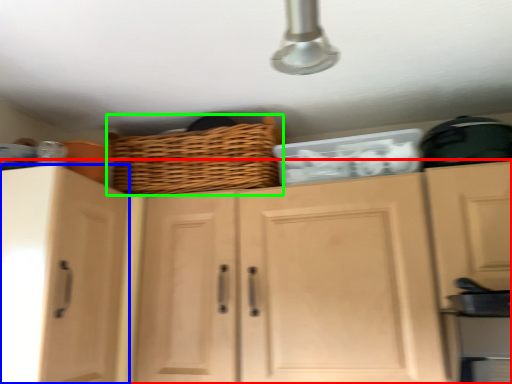
Question: Estimate the real-world distances between objects in this image. Which object is closer to cabinetry (highlighted by a red box), cabinetry (highlighted by a blue box) or basket (highlighted by a green box)?

Choices:
 (A) cabinetry
 (B) basket

Answer: (A)